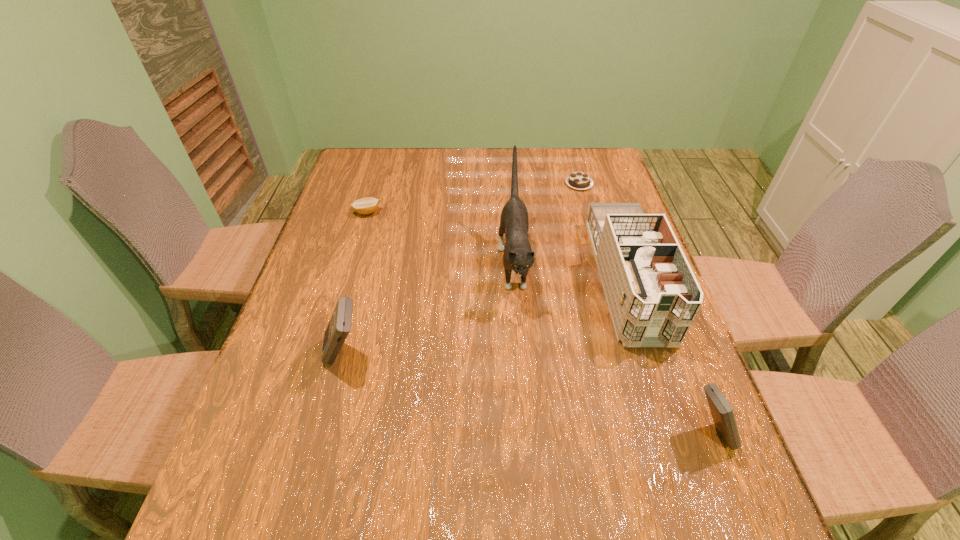
You are a GUI agent. You are given a task and a screenshot of the screen. Output one action in this format:
    pyautogui.click(x=<x>, y=<y>)
    Task: Click on the third object from left to right
    The width and height of the screenshot is (960, 540).
    Given the screenshot: What is the action you would take?
    pyautogui.click(x=518, y=256)

Identify the location of vacant space located on the front-facing side of the taller calculator. The width and height of the screenshot is (960, 540). (x=287, y=355).

You are a GUI agent. You are given a task and a screenshot of the screen. Output one action in this format:
    pyautogui.click(x=<x>, y=<y>)
    Task: Click on the vacant region located 0.080m on the front-facing side of the taller calculator
    The image size is (960, 540).
    Given the screenshot: What is the action you would take?
    pyautogui.click(x=287, y=355)

You are a GUI agent. You are given a task and a screenshot of the screen. Output one action in this format:
    pyautogui.click(x=<x>, y=<y>)
    Task: Click on the free space located 0.080m on the front of the chocolate cake
    
    Given the screenshot: What is the action you would take?
    pyautogui.click(x=586, y=207)

I want to click on vacant area located on the back of the lemon, so pyautogui.click(x=382, y=164).

I want to click on free space located at the entrance of the dollhouse, so click(x=689, y=468).

At what (x,y) coordinates should I click in order to perform the action: click on free space located at the face of the third object from left to right. Please return your answer as a coordinate pair (x, y). The width and height of the screenshot is (960, 540). Looking at the image, I should click on (524, 395).

What are the coordinates of `object at the far edge` in the screenshot? It's located at (x=578, y=180).

Identify the location of object at the near edge. Image resolution: width=960 pixels, height=540 pixels. (722, 413).

Locate an element on the screen. calculator at the left edge is located at coordinates (339, 326).